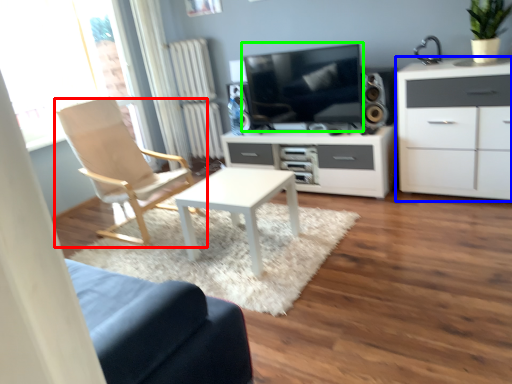
Question: Which object is positioned closest to chair (highlighted by a red box)? Select from cabinetry (highlighted by a blue box) and television (highlighted by a green box).

Choices:
 (A) cabinetry
 (B) television

Answer: (B)